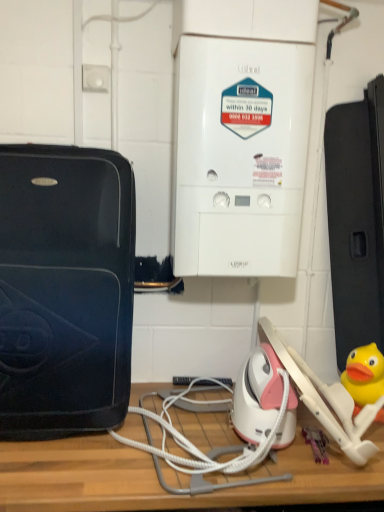
The image size is (384, 512). Describe the element at coordinates (65, 290) in the screenshot. I see `matte black suitcase at left, marked as the second home appliance in a right-to-left arrangement` at that location.

You are a GUI agent. You are given a task and a screenshot of the screen. Output one action in this format:
    pyautogui.click(x=<x>, y=<y>)
    Task: Click on the yellow rubber duck at lower right
    Image resolution: width=384 pixels, height=512 pixels.
    Given the screenshot: What is the action you would take?
    pyautogui.click(x=364, y=375)

What do you see at coordinates (194, 445) in the screenshot?
I see `white cord at center` at bounding box center [194, 445].

What are the coordinates of `wooden table at center` in the screenshot? It's located at (158, 481).

Who is more distant, wooden table at center or white cord at center?

Positioned behind is white cord at center.

Find the location of a particular element. This screenshot has width=384, height=512. cable on the left of wooden table at center is located at coordinates (194, 445).

Is wooden table at center turned away from white cord at center?

No, wooden table at center's orientation is not away from white cord at center.

Who is more distant, wooden table at center or white plastic boiler at center, placed as the second home appliance when sorted from left to right?

white plastic boiler at center, placed as the second home appliance when sorted from left to right, is more distant.

Is wooden table at center not within white plastic boiler at center, the 1th home appliance in the right-to-left sequence?

That's correct, wooden table at center is outside of white plastic boiler at center, the 1th home appliance in the right-to-left sequence.

Is wooden table at center positioned with its back to white plastic boiler at center, the 1th home appliance in the right-to-left sequence?

No.

At what (x,y) coordinates should I click in order to perform the action: click on home appliance that is the 2nd object located above the wooden table at center (from the image's perspective). Please return your answer as a coordinate pair (x, y). Looking at the image, I should click on tap(240, 134).

Between white cord at center and yellow rubber duck at lower right, which one has more height?

yellow rubber duck at lower right is taller.

Is white cord at center wider than yellow rubber duck at lower right?

Correct, the width of white cord at center exceeds that of yellow rubber duck at lower right.

From the image's perspective, is white cord at center positioned above or below yellow rubber duck at lower right?

From the image's perspective, white cord at center appears below yellow rubber duck at lower right.

From a real-world perspective, which is physically below, white plastic boiler at center, the 1th home appliance in the right-to-left sequence, or wooden table at center?

In real-world perspective, wooden table at center is lower.

Can you confirm if white plastic boiler at center, placed as the second home appliance when sorted from left to right, is shorter than wooden table at center?

In fact, white plastic boiler at center, placed as the second home appliance when sorted from left to right, may be taller than wooden table at center.

Considering the relative sizes of white plastic boiler at center, the 1th home appliance in the right-to-left sequence, and wooden table at center in the image provided, is white plastic boiler at center, the 1th home appliance in the right-to-left sequence, wider than wooden table at center?

Incorrect, the width of white plastic boiler at center, the 1th home appliance in the right-to-left sequence, does not surpass that of wooden table at center.

Can you tell me how much matte black suitcase at left, marked as the second home appliance in a right-to-left arrangement, and white plastic boiler at center, placed as the second home appliance when sorted from left to right, differ in facing direction?

They differ by 4.04 degrees in their facing directions.

Which object is closer to the camera, matte black suitcase at left, which is the first home appliance in left-to-right order, or white plastic boiler at center, the 1th home appliance in the right-to-left sequence?

matte black suitcase at left, which is the first home appliance in left-to-right order, is more forward.

From the picture: Is matte black suitcase at left, marked as the second home appliance in a right-to-left arrangement, to the left or to the right of white plastic boiler at center, the 1th home appliance in the right-to-left sequence, in the image?

From the image, it's evident that matte black suitcase at left, marked as the second home appliance in a right-to-left arrangement, is to the left of white plastic boiler at center, the 1th home appliance in the right-to-left sequence.

Can you confirm if matte black suitcase at left, marked as the second home appliance in a right-to-left arrangement, is thinner than white plastic boiler at center, placed as the second home appliance when sorted from left to right?

No.

From a real-world perspective, is wooden table at center positioned above or below matte black suitcase at left, marked as the second home appliance in a right-to-left arrangement?

wooden table at center is below matte black suitcase at left, marked as the second home appliance in a right-to-left arrangement.

Which object is closer to the camera taking this photo, wooden table at center or matte black suitcase at left, marked as the second home appliance in a right-to-left arrangement?

wooden table at center is more forward.

Consider the image. Can you see wooden table at center touching matte black suitcase at left, marked as the second home appliance in a right-to-left arrangement?

There is a gap between wooden table at center and matte black suitcase at left, marked as the second home appliance in a right-to-left arrangement.

Is matte black suitcase at left, which is the first home appliance in left-to-right order, looking in the opposite direction of wooden table at center?

No, matte black suitcase at left, which is the first home appliance in left-to-right order, is not facing away from wooden table at center.

From the image's perspective, is matte black suitcase at left, marked as the second home appliance in a right-to-left arrangement, beneath wooden table at center?

Incorrect, from the image's perspective, matte black suitcase at left, marked as the second home appliance in a right-to-left arrangement, is higher than wooden table at center.

Considering the sizes of objects matte black suitcase at left, which is the first home appliance in left-to-right order, and wooden table at center in the image provided, who is wider, matte black suitcase at left, which is the first home appliance in left-to-right order, or wooden table at center?

wooden table at center is wider.

Measure the distance between matte black suitcase at left, marked as the second home appliance in a right-to-left arrangement, and wooden table at center.

The distance of matte black suitcase at left, marked as the second home appliance in a right-to-left arrangement, from wooden table at center is 15.22 inches.

Identify the location of table on the right of white cord at center. (158, 481).

Where is `the 2nd home appliance above the wooden table at center (from the image's perspective)`? This screenshot has height=512, width=384. the 2nd home appliance above the wooden table at center (from the image's perspective) is located at coordinates (240, 134).

From the image, which object appears to be farther from yellow rubber duck at lower right, matte black suitcase at left, which is the first home appliance in left-to-right order, or wooden table at center?

matte black suitcase at left, which is the first home appliance in left-to-right order, is positioned further to the anchor yellow rubber duck at lower right.

When comparing their distances from white cord at center, does matte black suitcase at left, which is the first home appliance in left-to-right order, or wooden table at center seem closer?

The object closer to white cord at center is wooden table at center.

Looking at this image, based on their spatial positions, is white plastic boiler at center, placed as the second home appliance when sorted from left to right, or matte black suitcase at left, which is the first home appliance in left-to-right order, further from white cord at center?

white plastic boiler at center, placed as the second home appliance when sorted from left to right, is positioned further to the anchor white cord at center.

Which object lies nearer to the anchor point yellow rubber duck at lower right, wooden table at center or matte black suitcase at left, marked as the second home appliance in a right-to-left arrangement?

wooden table at center is positioned closer to the anchor yellow rubber duck at lower right.

From the image, which object appears to be nearer to wooden table at center, yellow rubber duck at lower right or white plastic boiler at center, placed as the second home appliance when sorted from left to right?

The object closer to wooden table at center is yellow rubber duck at lower right.

From the image, which object appears to be nearer to yellow rubber duck at lower right, white cord at center or matte black suitcase at left, which is the first home appliance in left-to-right order?

white cord at center is closer to yellow rubber duck at lower right.

Looking at the image, which one is located closer to matte black suitcase at left, marked as the second home appliance in a right-to-left arrangement, white cord at center or yellow rubber duck at lower right?

Among the two, white cord at center is located nearer to matte black suitcase at left, marked as the second home appliance in a right-to-left arrangement.

Considering their positions, is white plastic boiler at center, placed as the second home appliance when sorted from left to right, positioned further to matte black suitcase at left, which is the first home appliance in left-to-right order, than white cord at center?

white cord at center is positioned further to the anchor matte black suitcase at left, which is the first home appliance in left-to-right order.

You are a GUI agent. You are given a task and a screenshot of the screen. Output one action in this format:
    pyautogui.click(x=<x>, y=<y>)
    Task: Click on the home appliance between matte black suitcase at left, marked as the second home appliance in a right-to-left arrangement, and yellow rubber duck at lower right, in the horizontal direction
    This screenshot has height=512, width=384.
    Given the screenshot: What is the action you would take?
    pyautogui.click(x=240, y=134)

The width and height of the screenshot is (384, 512). In order to click on table located between matte black suitcase at left, marked as the second home appliance in a right-to-left arrangement, and yellow rubber duck at lower right in the left-right direction in this screenshot , I will do `click(158, 481)`.

I want to click on home appliance between white plastic boiler at center, placed as the second home appliance when sorted from left to right, and wooden table at center in the up-down direction, so click(65, 290).

This screenshot has height=512, width=384. Identify the location of table between white cord at center and yellow rubber duck at lower right in the horizontal direction. (158, 481).